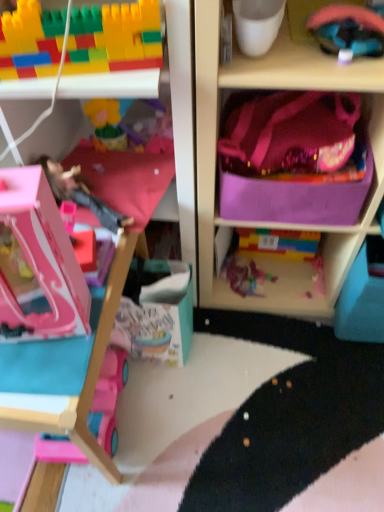
Question: Are pink fabric pillow at center and pink plastic toy car at lower left, the first toy positioned from the bottom, far apart?

Choices:
 (A) yes
 (B) no

Answer: (B)

Question: Is pink fabric pillow at center wider than pink plastic toy car at lower left, the first toy positioned from the bottom?

Choices:
 (A) no
 (B) yes

Answer: (B)

Question: Considering the relative sizes of pink fabric pillow at center and pink plastic toy car at lower left, the first toy positioned from the bottom, in the image provided, is pink fabric pillow at center taller than pink plastic toy car at lower left, the first toy positioned from the bottom,?

Choices:
 (A) no
 (B) yes

Answer: (A)

Question: Considering the relative sizes of pink fabric pillow at center and pink plastic toy car at lower left, the fifth toy when ordered from top to bottom, in the image provided, is pink fabric pillow at center thinner than pink plastic toy car at lower left, the fifth toy when ordered from top to bottom,?

Choices:
 (A) no
 (B) yes

Answer: (A)

Question: From a real-world perspective, is pink fabric pillow at center physically above pink plastic toy car at lower left, the first toy positioned from the bottom?

Choices:
 (A) no
 (B) yes

Answer: (B)

Question: Would you say rubberized pink helmet at upper right, marked as the 5th toy in a bottom-to-top arrangement, is to the left or to the right of translucent plastic toy at center, the 4th toy positioned from the top, in the picture?

Choices:
 (A) right
 (B) left

Answer: (A)

Question: From a real-world perspective, is rubberized pink helmet at upper right, which is the first toy from top to bottom, physically located above or below translucent plastic toy at center, the 4th toy positioned from the top?

Choices:
 (A) below
 (B) above

Answer: (B)

Question: Considering the positions of rubberized pink helmet at upper right, which is the first toy from top to bottom, and translucent plastic toy at center, acting as the second toy starting from the bottom, in the image, is rubberized pink helmet at upper right, which is the first toy from top to bottom, wider or thinner than translucent plastic toy at center, acting as the second toy starting from the bottom,?

Choices:
 (A) wide
 (B) thin

Answer: (B)

Question: Considering the positions of rubberized pink helmet at upper right, marked as the 5th toy in a bottom-to-top arrangement, and translucent plastic toy at center, acting as the second toy starting from the bottom, in the image, is rubberized pink helmet at upper right, marked as the 5th toy in a bottom-to-top arrangement, taller or shorter than translucent plastic toy at center, acting as the second toy starting from the bottom,?

Choices:
 (A) short
 (B) tall

Answer: (B)

Question: Relative to purple fabric bag at upper right, is rubberized pink helmet at upper right, marked as the 5th toy in a bottom-to-top arrangement, in front or behind?

Choices:
 (A) front
 (B) behind

Answer: (B)

Question: Considering the positions of rubberized pink helmet at upper right, marked as the 5th toy in a bottom-to-top arrangement, and purple fabric bag at upper right in the image, is rubberized pink helmet at upper right, marked as the 5th toy in a bottom-to-top arrangement, taller or shorter than purple fabric bag at upper right?

Choices:
 (A) short
 (B) tall

Answer: (A)

Question: From a real-world perspective, is rubberized pink helmet at upper right, which is the first toy from top to bottom, above or below purple fabric bag at upper right?

Choices:
 (A) below
 (B) above

Answer: (B)

Question: Is rubberized pink helmet at upper right, marked as the 5th toy in a bottom-to-top arrangement, bigger or smaller than purple fabric bag at upper right?

Choices:
 (A) small
 (B) big

Answer: (A)

Question: Which is correct: multicolored plastic blocks at upper left, the 4th toy positioned from the bottom, is inside pink plastic dollhouse at left, or outside of it?

Choices:
 (A) outside
 (B) inside

Answer: (B)

Question: Is multicolored plastic blocks at upper left, which is the second toy in top-to-bottom order, bigger or smaller than pink plastic dollhouse at left?

Choices:
 (A) small
 (B) big

Answer: (A)